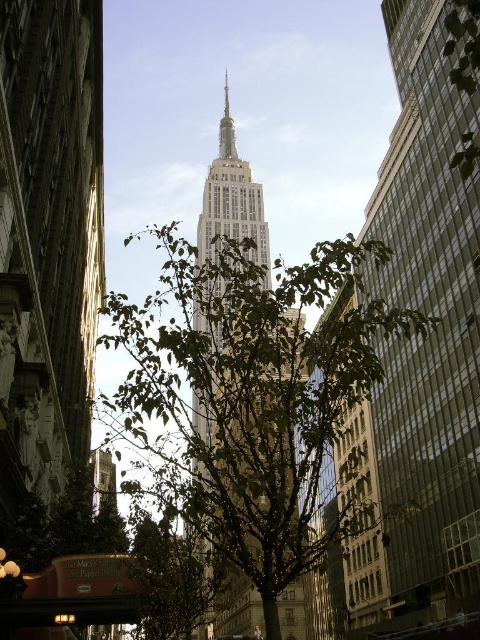
Question: Based on their relative distances, which object is farther from the gold metallic spire at center?

Choices:
 (A) gold stone tower at center
 (B) green leafy tree at center
 (C) glassy reflective skyscraper at center

Answer: (C)

Question: Can you confirm if green leafy tree at center is positioned above gold stone tower at center?

Choices:
 (A) yes
 (B) no

Answer: (B)

Question: Which of the following is the farthest from the observer?

Choices:
 (A) glassy reflective skyscraper at center
 (B) gold metallic spire at center
 (C) gold stone tower at center
 (D) green leafy tree at center

Answer: (B)

Question: Does green leafy tree at center appear on the right side of gold stone tower at center?

Choices:
 (A) yes
 (B) no

Answer: (A)

Question: Is glassy reflective skyscraper at center to the right of gold stone tower at center from the viewer's perspective?

Choices:
 (A) no
 (B) yes

Answer: (B)

Question: Which of the following is the closest to the observer?

Choices:
 (A) glassy reflective skyscraper at center
 (B) gold stone tower at center
 (C) green leafy tree at center

Answer: (A)